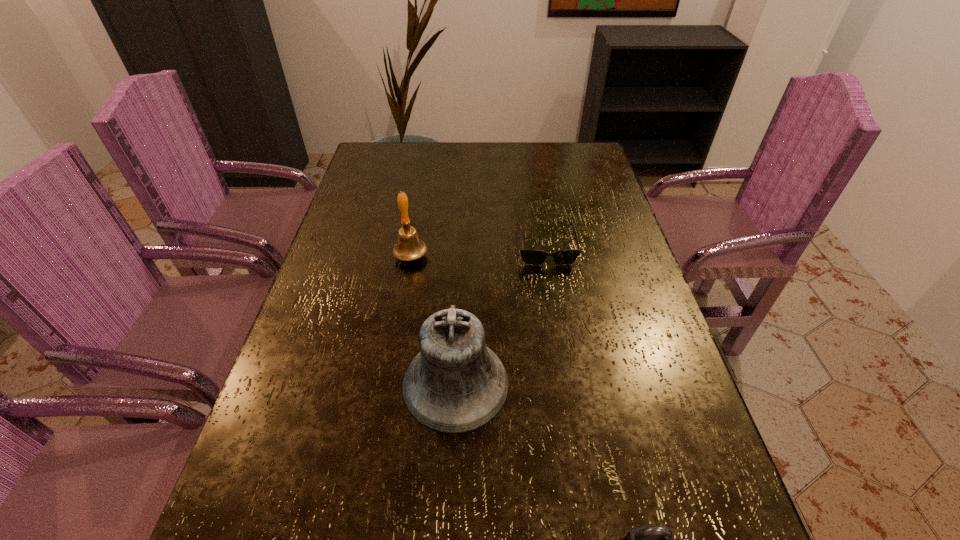
Image resolution: width=960 pixels, height=540 pixels. What are the coordinates of `vacant region at the far right corner of the desktop` in the screenshot? It's located at (596, 162).

Where is `free space that is in between the third farthest object and the sunglasses`? free space that is in between the third farthest object and the sunglasses is located at coordinates (500, 315).

Where is `vacant area that lies between the third farthest object and the sunglasses`? This screenshot has width=960, height=540. vacant area that lies between the third farthest object and the sunglasses is located at coordinates (500, 315).

Find the location of a particular element. free spot between the farther bell and the shortest object is located at coordinates (478, 251).

This screenshot has width=960, height=540. What are the coordinates of `free point between the nearer bell and the sunglasses` in the screenshot? It's located at (500, 315).

At what (x,y) coordinates should I click in order to perform the action: click on empty location between the sunglasses and the farther bell. Please return your answer as a coordinate pair (x, y). This screenshot has width=960, height=540. Looking at the image, I should click on (478, 251).

The image size is (960, 540). I want to click on free space between the nearer bell and the shortest object, so click(500, 315).

Locate an element on the screen. the closest object to the shortest object is located at coordinates (409, 247).

Locate an element on the screen. the closest object to the second nearest object is located at coordinates coord(655,539).